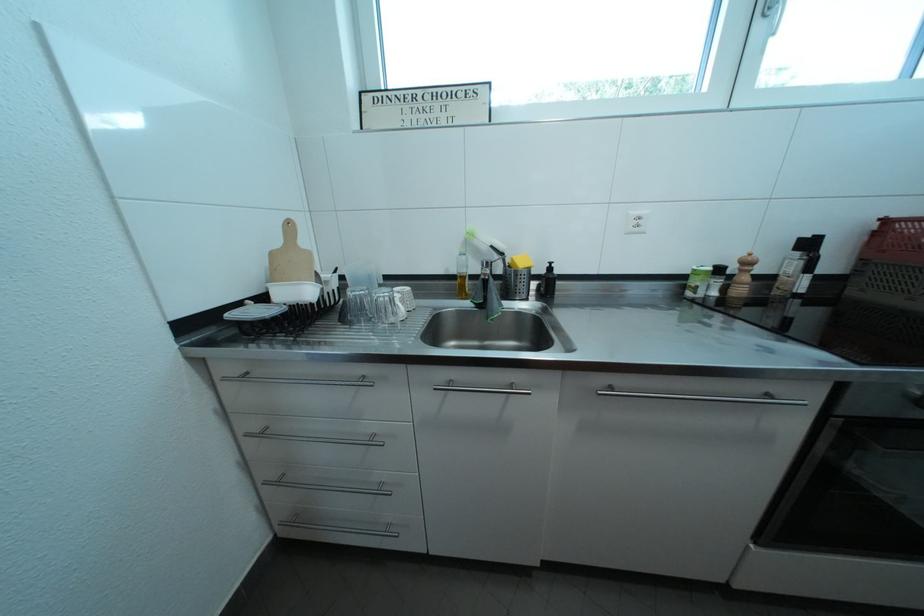
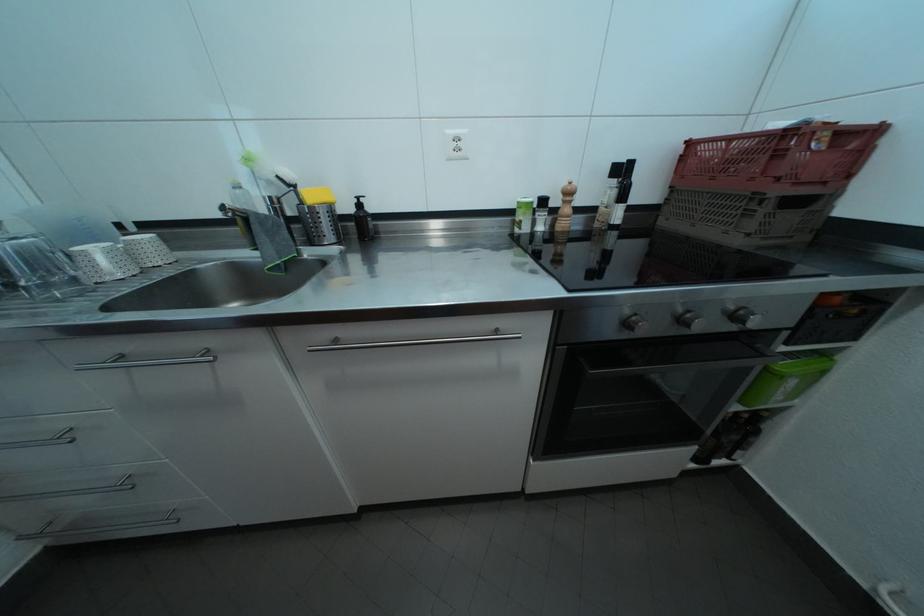
Find the pixel in the second image that matches point (639, 219) in the first image.

(456, 138)